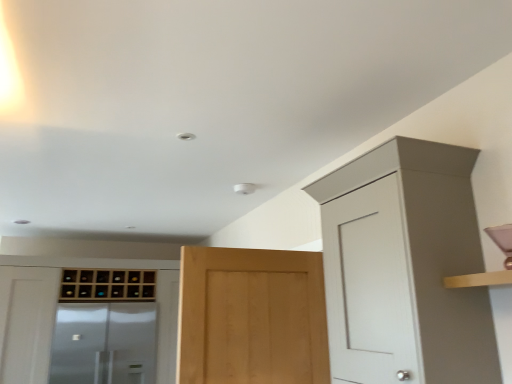
Question: Visually, is wooden wine rack at center, which appears as the second cabinetry when viewed from the right, positioned to the left or to the right of light brown wood door at center?

Choices:
 (A) left
 (B) right

Answer: (A)

Question: From their relative heights in the image, would you say wooden wine rack at center, positioned as the 3th cabinetry in front-to-back order, is taller or shorter than light brown wood door at center?

Choices:
 (A) short
 (B) tall

Answer: (A)

Question: Which is farther from the light brown wood door at center?

Choices:
 (A) wooden wine rack at center, the second cabinetry when ordered from left to right
 (B) matte white cabinet at upper right, the third cabinetry from the back
 (C) transparent glass screen door at lower left
 (D) wooden wine rack at left, acting as the 1th cabinetry starting from the left

Answer: (D)

Question: Based on their relative distances, which object is farther from the transparent glass screen door at lower left?

Choices:
 (A) matte white cabinet at upper right, the first cabinetry viewed from the front
 (B) wooden wine rack at center, the second cabinetry when ordered from left to right
 (C) wooden wine rack at left, positioned as the third cabinetry in right-to-left order
 (D) light brown wood door at center

Answer: (A)